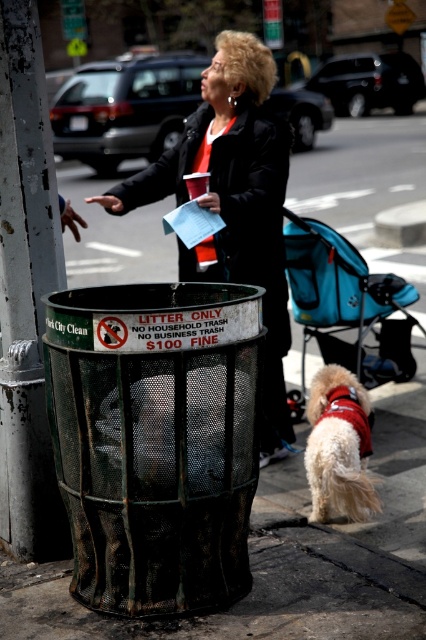
Is blue fabric stroller at center taller than fluffy white dog at lower right?

Correct, blue fabric stroller at center is much taller as fluffy white dog at lower right.

Which of these two, blue fabric stroller at center or fluffy white dog at lower right, stands taller?

With more height is blue fabric stroller at center.

Between point (348, 317) and point (316, 378), which one is positioned in front?

Point (316, 378)

Identify the location of blue fabric stroller at center. The width and height of the screenshot is (426, 640). (340, 300).

Can you confirm if black leather jacket at center is wider than fluffy white dog at lower right?

Yes, black leather jacket at center is wider than fluffy white dog at lower right.

Who is shorter, black leather jacket at center or fluffy white dog at lower right?

With less height is fluffy white dog at lower right.

Identify the location of black leather jacket at center. (233, 202).

Is green painted metal pole at left shorter than fluffy white dog at lower right?

Incorrect, green painted metal pole at left's height does not fall short of fluffy white dog at lower right's.

Is green painted metal pole at left taller than fluffy white dog at lower right?

Correct, green painted metal pole at left is much taller as fluffy white dog at lower right.

From the picture: Who is more distant from viewer, (32, 496) or (362, 387)?

Point (362, 387)

Identify the location of green painted metal pole at left. This screenshot has width=426, height=640. (26, 291).